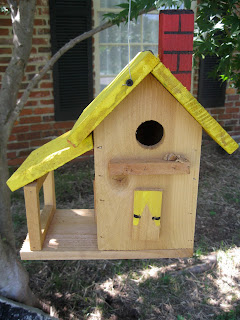
Identify the location of windowpane. [x=115, y=52].